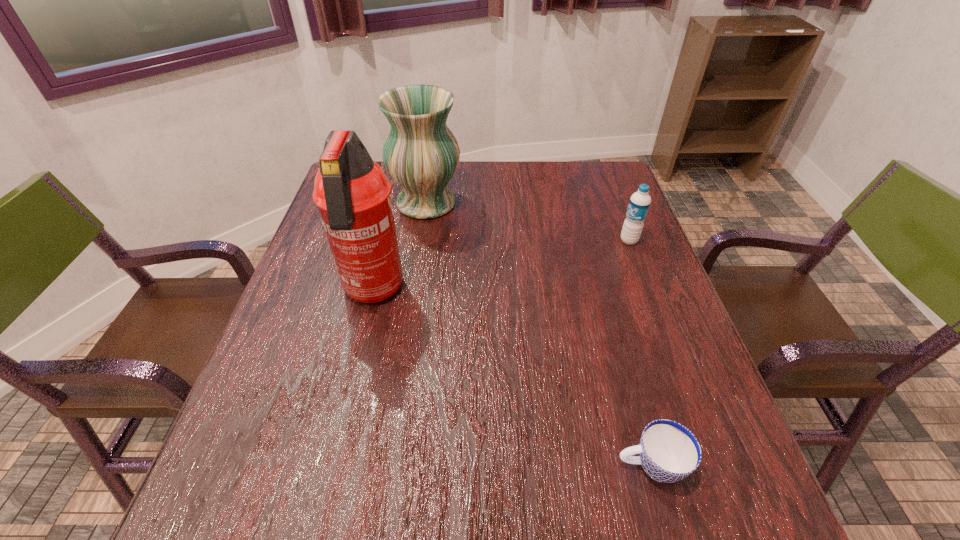
I want to click on cup that is at the right edge, so click(x=669, y=452).

Where is `object present at the near right corner`? object present at the near right corner is located at coordinates (669, 452).

Where is `vacant space at the far edge of the desktop`? vacant space at the far edge of the desktop is located at coordinates (494, 193).

What are the coordinates of `vacant point at the near edge` in the screenshot? It's located at (379, 523).

You are a GUI agent. You are given a task and a screenshot of the screen. Output one action in this format:
    pyautogui.click(x=<x>, y=<y>)
    Task: Click on the free space at the left edge of the desktop
    
    Given the screenshot: What is the action you would take?
    pyautogui.click(x=289, y=383)

At what (x,y) coordinates should I click in order to perform the action: click on vacant space at the right edge. Please return your answer as a coordinate pair (x, y). Looking at the image, I should click on (624, 261).

Locate an element on the screen. The width and height of the screenshot is (960, 540). free point at the near right corner is located at coordinates 710,524.

Where is `free space between the tallest object and the third tallest object`? The height and width of the screenshot is (540, 960). free space between the tallest object and the third tallest object is located at coordinates (501, 266).

Locate an element on the screen. The height and width of the screenshot is (540, 960). free spot between the vase and the third object from left to right is located at coordinates (539, 334).

Find the location of a particular element. The height and width of the screenshot is (540, 960). vacant space that's between the tallest object and the shortest object is located at coordinates (512, 379).